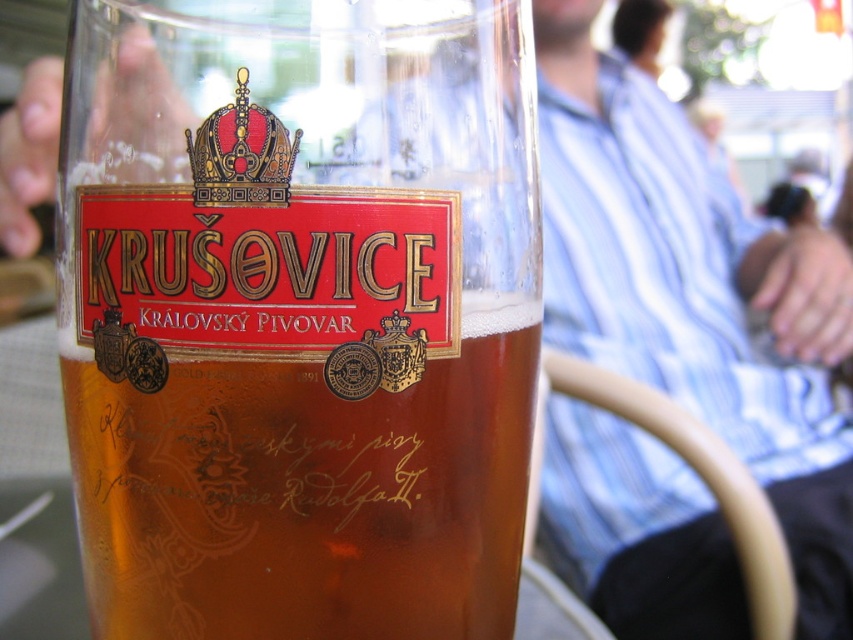
You are a bartender and want to place a small decorative sticker on the side of the translucent glass beer at center without covering the gold metallic crown at upper center. Is there enough space on the glass for the sticker?

The translucent glass beer at center has a larger size compared to gold metallic crown at upper center, so there is enough space on the glass to place the sticker without covering the crown.

You are a bartender trying to place a new label on the glass mug. The label must be placed at the exact center of the mug. Given that the center of the mug is at point (299, 316), where should you position the label?

The label should be placed at the point (299, 316), as that is the center of the mug where the translucent glass beer is located.